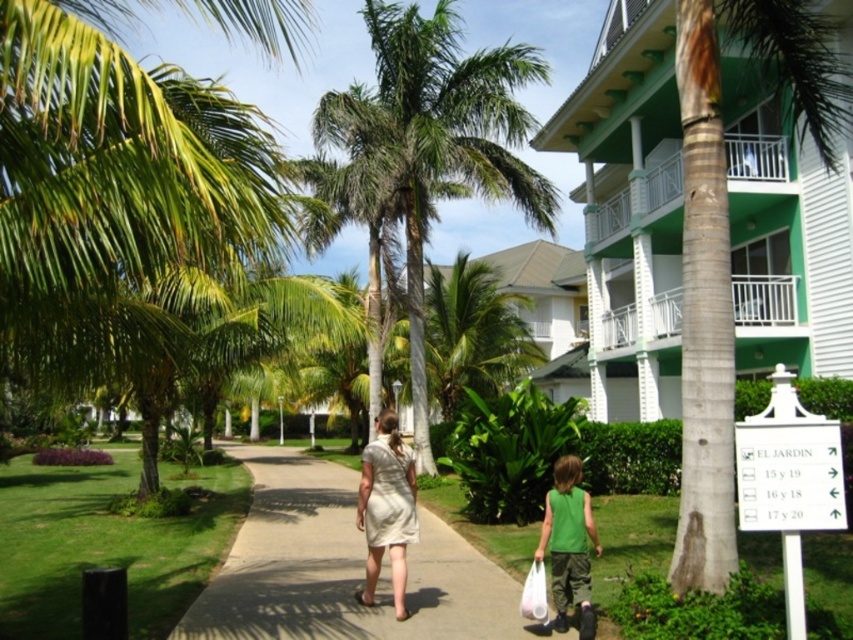
Question: Is green painted wood balcony at upper right to the right of green grass at center from the viewer's perspective?

Choices:
 (A) no
 (B) yes

Answer: (B)

Question: Which of the following is the closest to the observer?

Choices:
 (A) (570, 592)
 (B) (660, 113)
 (C) (401, 470)

Answer: (A)

Question: Is green grass at center below green matte shirt at lower right?

Choices:
 (A) yes
 (B) no

Answer: (A)

Question: Where is green painted wood balcony at upper right located in relation to green matte shirt at lower right in the image?

Choices:
 (A) above
 (B) below

Answer: (A)

Question: Which of the following is the farthest from the observer?

Choices:
 (A) green matte shirt at lower right
 (B) light beige dress at center
 (C) green painted wood balcony at upper right
 (D) green leafy palm tree at center

Answer: (D)

Question: Considering the real-world distances, which object is farthest from the green painted wood balcony at upper right?

Choices:
 (A) green leafy palm tree at center
 (B) light beige dress at center
 (C) green matte shirt at lower right

Answer: (B)